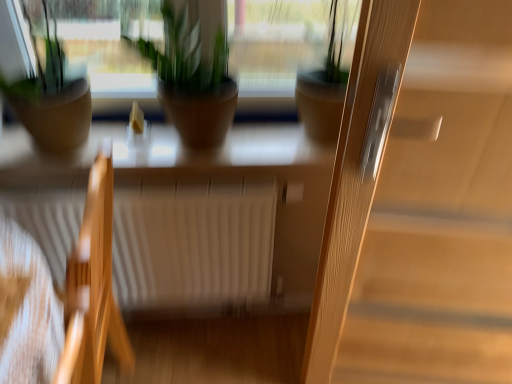
The height and width of the screenshot is (384, 512). Describe the element at coordinates (326, 81) in the screenshot. I see `green matte plant pot at center, which ranks as the 3th houseplant in left-to-right order` at that location.

Describe the element at coordinates (93, 288) in the screenshot. The width and height of the screenshot is (512, 384). I see `wooden chair at left` at that location.

Measure the distance between matte brown pot at left, which is counted as the third houseplant, starting from the right, and camera.

matte brown pot at left, which is counted as the third houseplant, starting from the right, is 1.06 meters from camera.

Find the location of a particular element. green matte plant pot at center, the first houseplant from the right is located at coordinates (326, 81).

Is matte brown pot at left, which is the first houseplant from left to right, positioned far away from green matte plant pot at center, the first houseplant from the right?

No, there isn't a large distance between matte brown pot at left, which is the first houseplant from left to right, and green matte plant pot at center, the first houseplant from the right.

Which of these two, matte brown pot at left, which is the first houseplant from left to right, or green matte plant pot at center, which ranks as the 3th houseplant in left-to-right order, is thinner?

green matte plant pot at center, which ranks as the 3th houseplant in left-to-right order, is thinner.

Based on their positions, is matte brown pot at left, which is the first houseplant from left to right, located to the left or right of green matte plant pot at center, which ranks as the 3th houseplant in left-to-right order?

matte brown pot at left, which is the first houseplant from left to right, is to the left of green matte plant pot at center, which ranks as the 3th houseplant in left-to-right order.

Where is `the 2nd houseplant to the right of the matte brown pot at left, which is the first houseplant from left to right, starting your count from the anchor`? the 2nd houseplant to the right of the matte brown pot at left, which is the first houseplant from left to right, starting your count from the anchor is located at coordinates (326, 81).

Can you confirm if light brown wood screen door at right is wider than wooden chair at left?

In fact, light brown wood screen door at right might be narrower than wooden chair at left.

Considering the positions of objects light brown wood screen door at right and wooden chair at left in the image provided, who is more to the left, light brown wood screen door at right or wooden chair at left?

From the viewer's perspective, wooden chair at left appears more on the left side.

From a real-world perspective, is light brown wood screen door at right positioned over wooden chair at left based on gravity?

Yes, from a real-world perspective, light brown wood screen door at right is above wooden chair at left.

Is light brown wood screen door at right looking in the opposite direction of wooden chair at left?

No, light brown wood screen door at right is not facing away from wooden chair at left.

This screenshot has width=512, height=384. In order to click on chair lying in front of the green matte plant pot at center, which ranks as the 3th houseplant in left-to-right order in this screenshot , I will do tap(93, 288).

Can you confirm if wooden chair at left is smaller than green matte plant pot at center, which ranks as the 3th houseplant in left-to-right order?

No.

Is wooden chair at left taller than green matte plant pot at center, which ranks as the 3th houseplant in left-to-right order?

Indeed, wooden chair at left has a greater height compared to green matte plant pot at center, which ranks as the 3th houseplant in left-to-right order.

Based on the photo, considering the relative positions of wooden chair at left and green matte plant pot at center, the first houseplant from the right, in the image provided, is wooden chair at left to the left of green matte plant pot at center, the first houseplant from the right, from the viewer's perspective?

Yes, wooden chair at left is to the left of green matte plant pot at center, the first houseplant from the right.

In the scene shown: Considering the sizes of objects wooden chair at left and matte brown pot at center, which is counted as the second houseplant, starting from the right, in the image provided, who is shorter, wooden chair at left or matte brown pot at center, which is counted as the second houseplant, starting from the right,?

Answer: With less height is matte brown pot at center, which is counted as the second houseplant, starting from the right.

Visually, is wooden chair at left positioned to the left or to the right of matte brown pot at center, acting as the 2th houseplant starting from the left?

Based on their positions, wooden chair at left is located to the left of matte brown pot at center, acting as the 2th houseplant starting from the left.

I want to click on houseplant that is the 2nd one when counting upward from the wooden chair at left (from the image's perspective), so click(194, 70).

Which of these two, matte brown pot at left, which is the first houseplant from left to right, or light brown wood screen door at right, stands taller?

light brown wood screen door at right.

How many degrees apart are the facing directions of matte brown pot at left, which is the first houseplant from left to right, and light brown wood screen door at right?

matte brown pot at left, which is the first houseplant from left to right, and light brown wood screen door at right are facing 11.4 degrees away from each other.

From a real-world perspective, is matte brown pot at left, which is the first houseplant from left to right, physically above light brown wood screen door at right?

Yes.

Based on the photo, how far apart are matte brown pot at left, which is the first houseplant from left to right, and light brown wood screen door at right?

matte brown pot at left, which is the first houseplant from left to right, is 35.78 inches away from light brown wood screen door at right.

Is wooden chair at left turned away from light brown wood screen door at right?

Yes, wooden chair at left is facing away from light brown wood screen door at right.

Can you confirm if wooden chair at left is positioned to the right of light brown wood screen door at right?

No.

Which of these two, wooden chair at left or light brown wood screen door at right, is thinner?

Result: With smaller width is light brown wood screen door at right.

Looking at the image, does wooden chair at left seem bigger or smaller compared to light brown wood screen door at right?

In the image, wooden chair at left appears to be smaller than light brown wood screen door at right.

From a real-world perspective, is matte brown pot at center, acting as the 2th houseplant starting from the left, below light brown wood screen door at right?

No.

Between matte brown pot at center, which is counted as the second houseplant, starting from the right, and light brown wood screen door at right, which one has less height?

matte brown pot at center, which is counted as the second houseplant, starting from the right, is shorter.

Is light brown wood screen door at right a part of matte brown pot at center, acting as the 2th houseplant starting from the left?

No, matte brown pot at center, acting as the 2th houseplant starting from the left, does not contain light brown wood screen door at right.

From the image's perspective, which object appears higher, matte brown pot at center, which is counted as the second houseplant, starting from the right, or light brown wood screen door at right?

matte brown pot at center, which is counted as the second houseplant, starting from the right.

The height and width of the screenshot is (384, 512). I want to click on houseplant that is the 2nd one when counting rightward from the matte brown pot at left, which is the first houseplant from left to right, so click(326, 81).

Identify the location of screen door lying above the wooden chair at left (from the image's perspective). The height and width of the screenshot is (384, 512). (424, 214).

From the image, which object appears to be nearer to green matte plant pot at center, which ranks as the 3th houseplant in left-to-right order, white matte radiator at center or wooden chair at left?

white matte radiator at center lies closer to green matte plant pot at center, which ranks as the 3th houseplant in left-to-right order, than the other object.

Based on their spatial positions, is matte brown pot at center, acting as the 2th houseplant starting from the left, or wooden chair at left further from matte brown pot at left, which is counted as the third houseplant, starting from the right?

Based on the image, wooden chair at left appears to be further to matte brown pot at left, which is counted as the third houseplant, starting from the right.

Looking at the image, which one is located closer to green matte plant pot at center, the first houseplant from the right, matte brown pot at center, which is counted as the second houseplant, starting from the right, or wooden chair at left?

matte brown pot at center, which is counted as the second houseplant, starting from the right, is closer to green matte plant pot at center, the first houseplant from the right.

Which object lies nearer to the anchor point matte brown pot at center, which is counted as the second houseplant, starting from the right, white matte radiator at center or light brown wood screen door at right?

Among the two, white matte radiator at center is located nearer to matte brown pot at center, which is counted as the second houseplant, starting from the right.

Estimate the real-world distances between objects in this image. Which object is further from light brown wood screen door at right, matte brown pot at center, which is counted as the second houseplant, starting from the right, or green matte plant pot at center, which ranks as the 3th houseplant in left-to-right order?

Result: matte brown pot at center, which is counted as the second houseplant, starting from the right.

Based on their spatial positions, is light brown wood screen door at right or white matte radiator at center closer to green matte plant pot at center, the first houseplant from the right?

light brown wood screen door at right is closer to green matte plant pot at center, the first houseplant from the right.

Based on their spatial positions, is light brown wood screen door at right or wooden chair at left further from matte brown pot at center, acting as the 2th houseplant starting from the left?

light brown wood screen door at right.

Considering their positions, is light brown wood screen door at right positioned closer to matte brown pot at left, which is the first houseplant from left to right, than green matte plant pot at center, which ranks as the 3th houseplant in left-to-right order?

green matte plant pot at center, which ranks as the 3th houseplant in left-to-right order, is closer to matte brown pot at left, which is the first houseplant from left to right.

Image resolution: width=512 pixels, height=384 pixels. I want to click on radiator between matte brown pot at center, which is counted as the second houseplant, starting from the right, and wooden chair at left from top to bottom, so click(193, 244).

Identify the location of radiator that lies between green matte plant pot at center, the first houseplant from the right, and wooden chair at left from top to bottom. This screenshot has height=384, width=512. (193, 244).

At what (x,y) coordinates should I click in order to perform the action: click on radiator between matte brown pot at left, which is counted as the third houseplant, starting from the right, and green matte plant pot at center, which ranks as the 3th houseplant in left-to-right order. Please return your answer as a coordinate pair (x, y). The width and height of the screenshot is (512, 384). Looking at the image, I should click on (193, 244).

The image size is (512, 384). What are the coordinates of `chair between matte brown pot at left, which is the first houseplant from left to right, and green matte plant pot at center, the first houseplant from the right, in the horizontal direction` in the screenshot? It's located at pos(93,288).